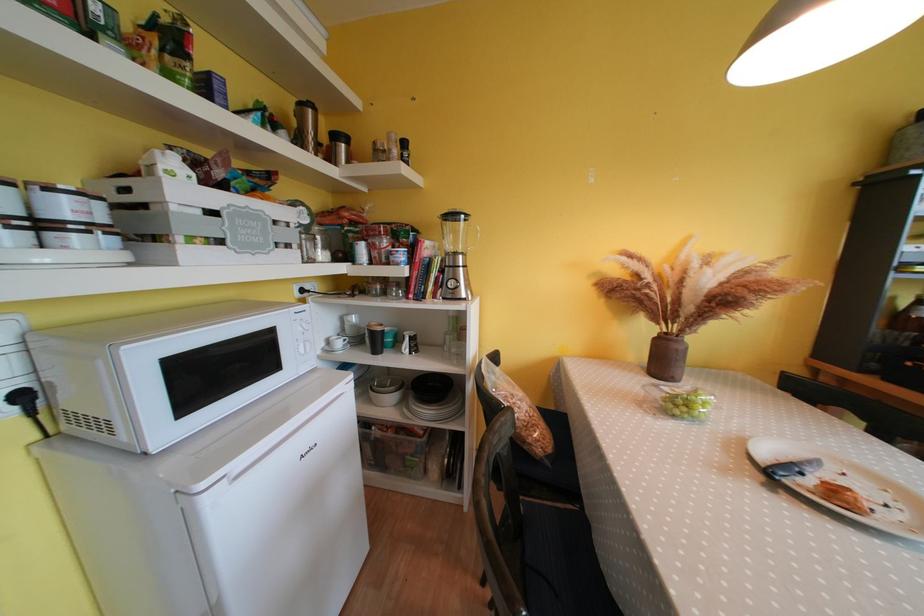
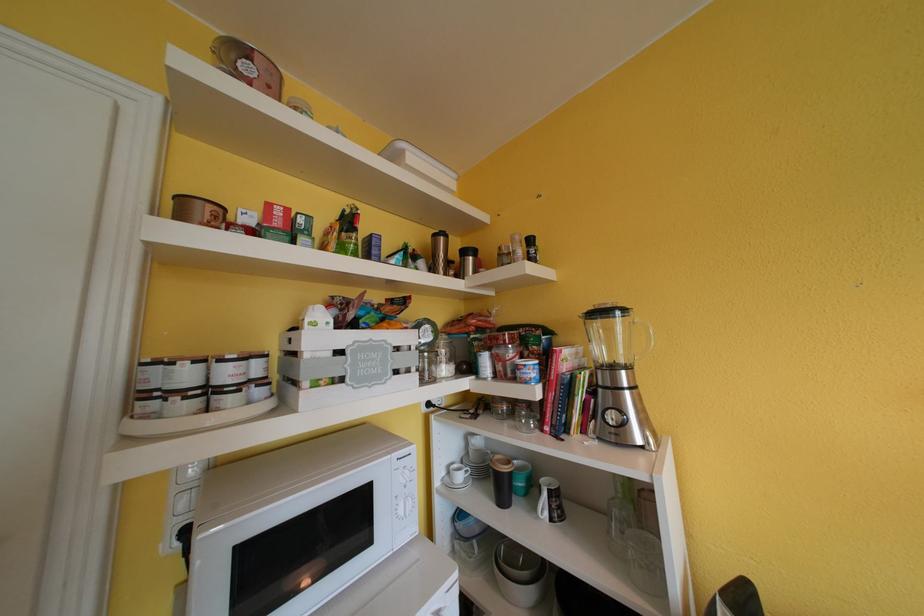
From the picture: First-person continuous shooting, in which direction is the camera rotating?

The camera's rotation is toward left-up.